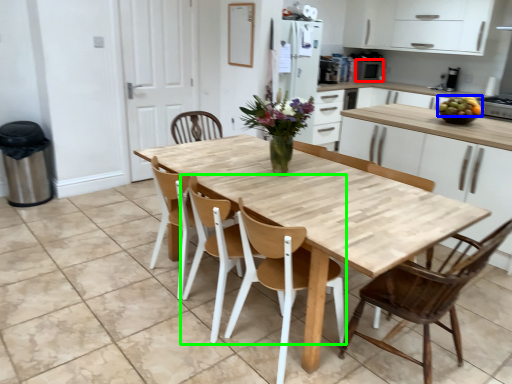
Question: Which object is the farthest from appliance (highlighted by a red box)? Choose among these: fruit (highlighted by a blue box) or chair (highlighted by a green box).

Choices:
 (A) fruit
 (B) chair

Answer: (B)